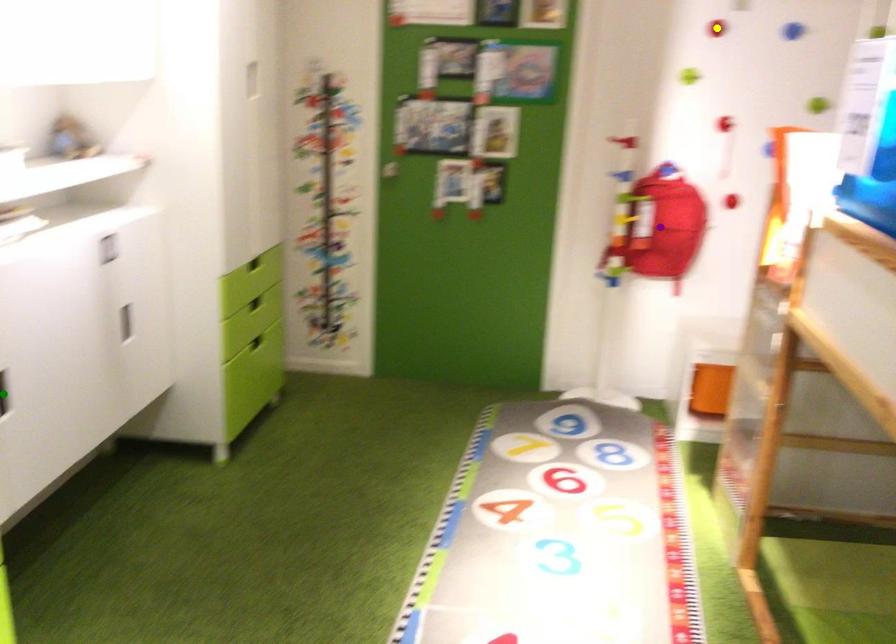
Order these from nearest to farthest:
yellow point, green point, purple point

green point, yellow point, purple point